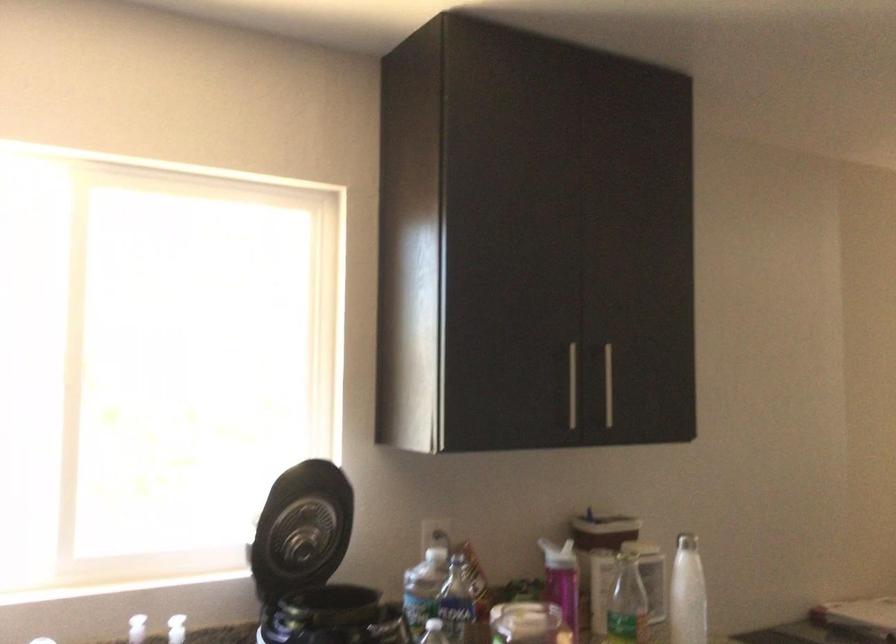
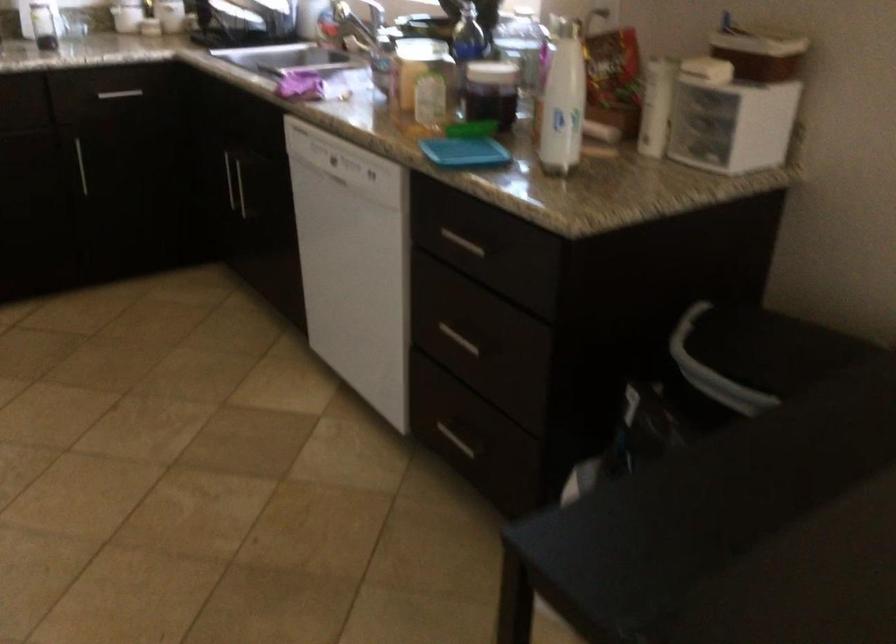
Question: I am providing you with two images of the same scene from different viewpoints. Please identify which objects are invisible in image2.

Choices:
 (A) small gold container
 (B) plastic water bottle
 (C) jar with white lid
 (D) silver cabinet handle

Answer: (B)